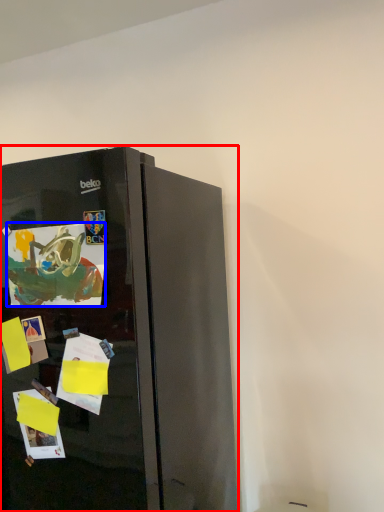
Question: Which of the following is the closest to the observer, refrigerator (highlighted by a red box) or postcard (highlighted by a blue box)?

Choices:
 (A) refrigerator
 (B) postcard

Answer: (A)